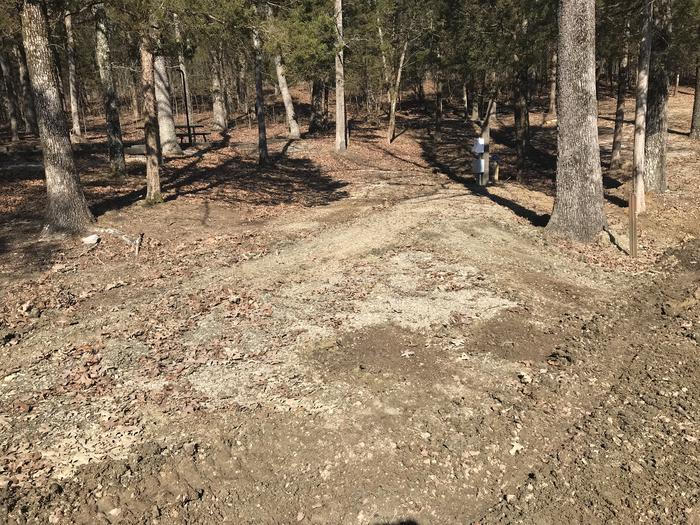
Locate an element on the screen. pipe in which electric wires go is located at coordinates (479, 183).